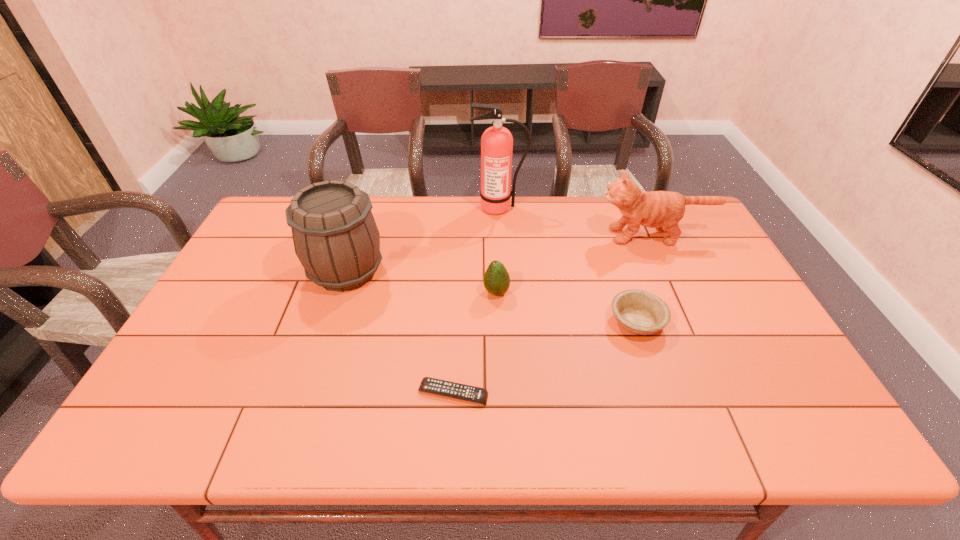
This screenshot has width=960, height=540. Find the location of `the tallest object`. the tallest object is located at coordinates (496, 142).

Locate an element on the screen. fire extinguisher is located at coordinates (496, 142).

I want to click on wine bucket, so click(x=336, y=239).

This screenshot has height=540, width=960. I want to click on cat, so click(663, 210).

Identify the location of avocado. (496, 279).

I want to click on bowl, so click(640, 312).

Locate an element on the screen. This screenshot has height=540, width=960. the nearest object is located at coordinates (479, 395).

What are the coordinates of `remote control` in the screenshot? It's located at (479, 395).

At what (x,y) coordinates should I click in order to perform the action: click on vacant space located on the handle side of the tallest object. Please return your answer as a coordinate pair (x, y). The height and width of the screenshot is (540, 960). Looking at the image, I should click on (504, 301).

Where is `free spot located 0.230m on the right of the wine bucket`? The width and height of the screenshot is (960, 540). free spot located 0.230m on the right of the wine bucket is located at coordinates (463, 271).